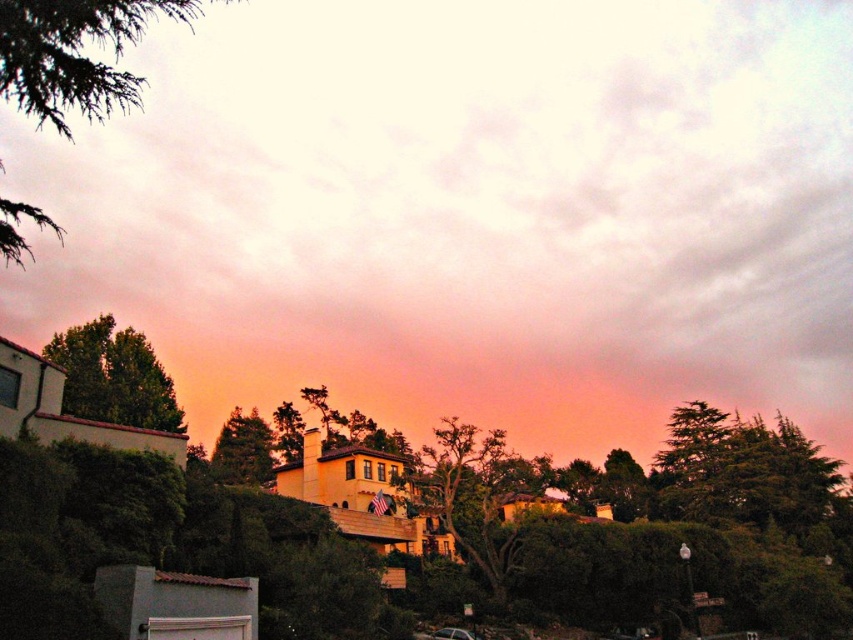
You are standing in the residential area depicted in the scene and want to take a photo of the pink matte cloud at upper center. To ensure the cloud is centered in your photo, where should you position your camera? Use the coordinate system provided in the description to guide your answer.

The pink matte cloud at upper center is located at coordinates 0.333 on the x axis and 0.550 on the y axis, so you should position your camera to center the view at those coordinates to capture the cloud in the middle of the photo.

You are an architect designing a new garden and want to place two green leafy trees in your design. The first one is the green leafy tree at upper left and the second is the green leafy tree at left. Based on the image, which tree should you place closer to the entrance to ensure it doesn???t block the view of the smaller tree?

The green leafy tree at upper left is larger in size than the green leafy tree at left, so you should place the smaller green leafy tree at left closer to the entrance to ensure it doesn???t block the view of the larger tree.